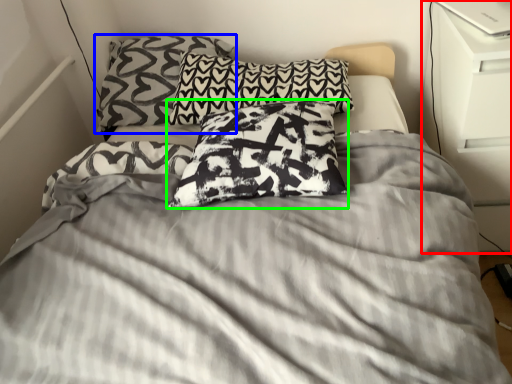
Question: Which object is the farthest from dresser (highlighted by a red box)? Choose among these: pillow (highlighted by a blue box) or pillow (highlighted by a green box).

Choices:
 (A) pillow
 (B) pillow

Answer: (A)